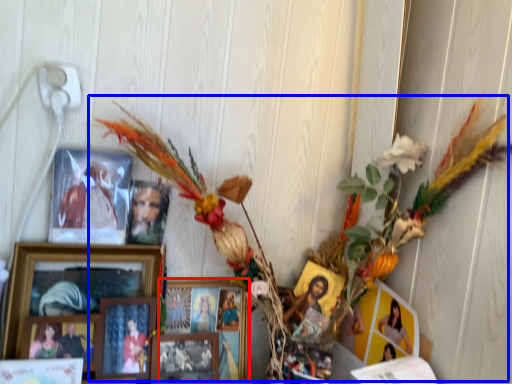
Question: Which object appears farthest to the camera in this image, picture frame (highlighted by a red box) or floral arrangement (highlighted by a blue box)?

Choices:
 (A) picture frame
 (B) floral arrangement

Answer: (A)